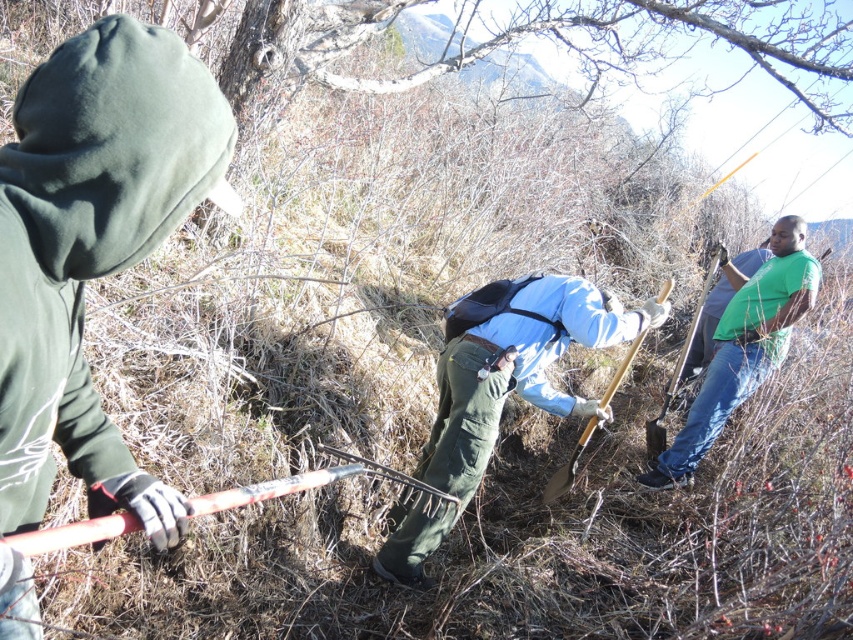
Question: Where is wooden shovel at center located in relation to wooden shovel at right in the image?

Choices:
 (A) right
 (B) left

Answer: (B)

Question: Which point is closer to the camera?

Choices:
 (A) (531, 340)
 (B) (686, 435)
 (C) (376, 8)

Answer: (A)

Question: Can you confirm if bare wood tree at upper center is positioned above green matte shirt at right?

Choices:
 (A) yes
 (B) no

Answer: (A)

Question: Is bare wood tree at upper center to the right of wooden shovel at center from the viewer's perspective?

Choices:
 (A) no
 (B) yes

Answer: (B)

Question: Which point is farther from the camera taking this photo?

Choices:
 (A) (143, 493)
 (B) (694, 316)
 (C) (706, 396)
 (D) (635, 348)

Answer: (B)

Question: Among these points, which one is farthest from the camera?

Choices:
 (A) (706, 33)
 (B) (670, 476)
 (C) (663, 442)

Answer: (A)